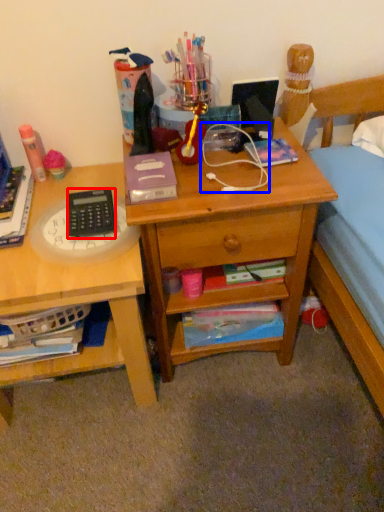
Question: Which point is further to the camera, remote control (highlighted by a red box) or twin (highlighted by a blue box)?

Choices:
 (A) remote control
 (B) twin

Answer: (A)